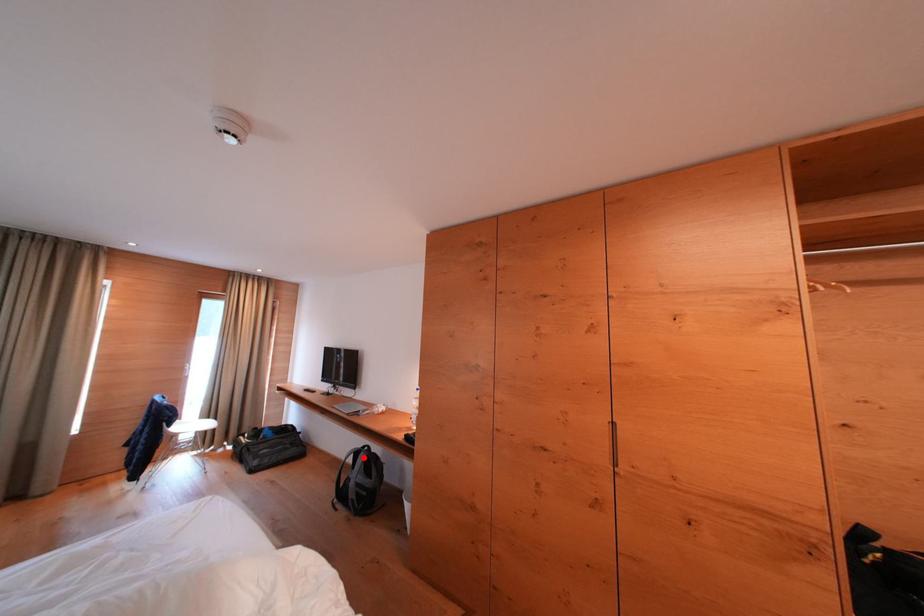
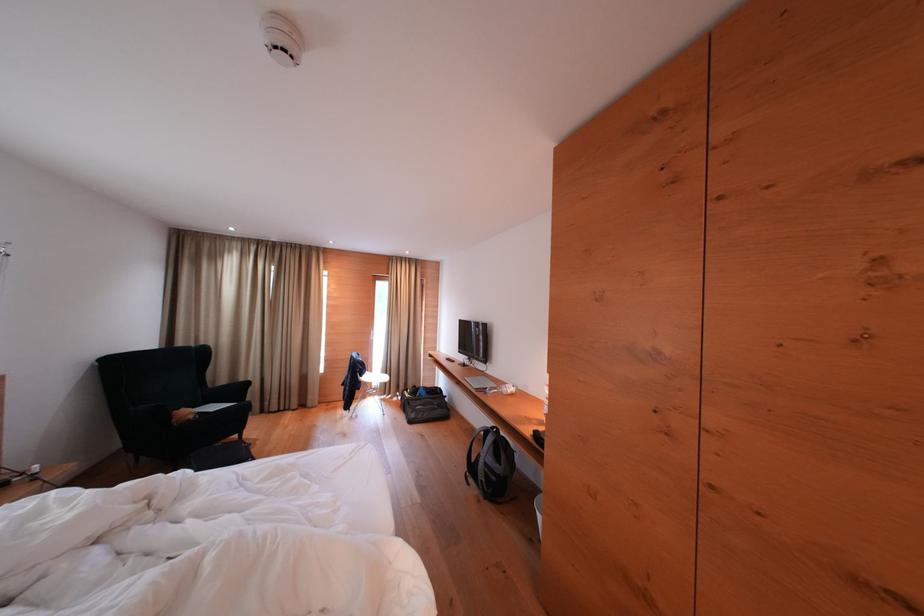
Where in the second image is the point corresponding to the highlighted location from the first image?

(493, 437)